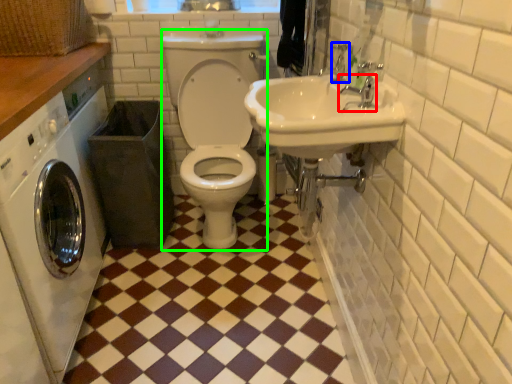
Question: Based on their relative distances, which object is nearer to tap (highlighted by a red box)? Choose from faucet (highlighted by a blue box) and squat (highlighted by a green box).

Choices:
 (A) faucet
 (B) squat

Answer: (A)